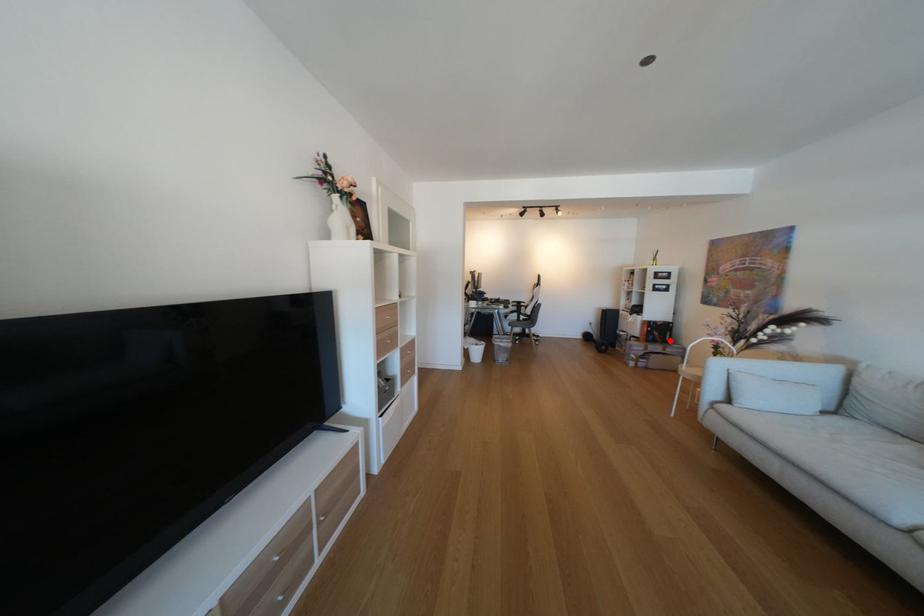
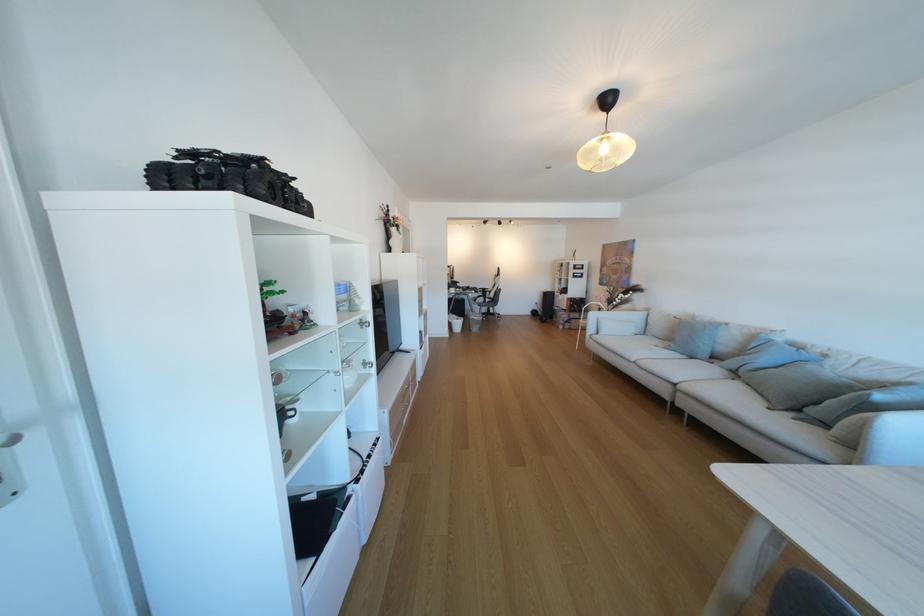
In the second image, find the point that corresponds to the highlighted location in the first image.

(589, 310)